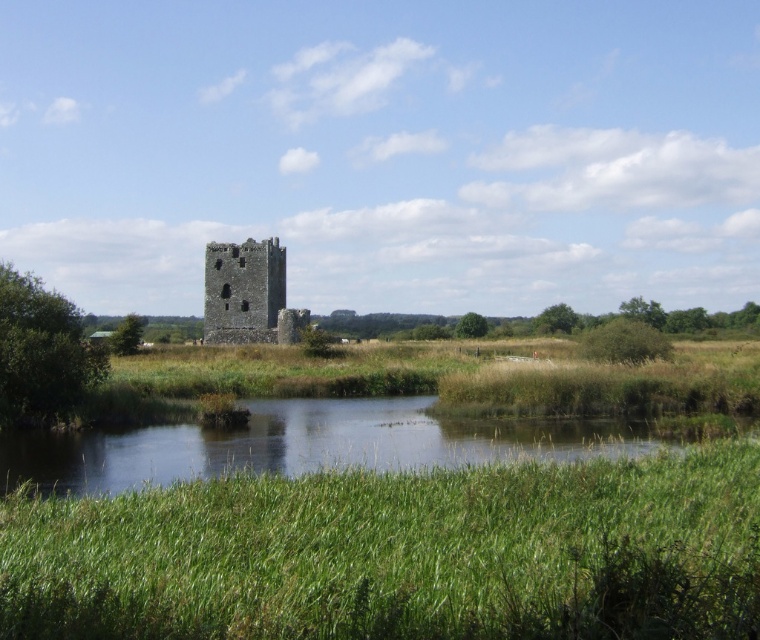
You are standing at the edge of the green grassy river at lower center and want to reach the rustic stone tower at center. Which direction should you head to move towards it?

To reach the rustic stone tower at center from the green grassy river at lower center, you should head to the left since the river is located to the right of the tower.

You are planning to cross the green grassy river at lower center to reach the rustic stone tower at center. Given that the river is wider than the tower, can you estimate the minimum length of the bridge you need to build?

The green grassy river at lower center is wider than the rustic stone tower at center. Therefore, the bridge must be at least as wide as the river to span it, so the minimum length of the bridge should be equal to the width of the river.

You are standing at the edge of the green grassy river at lower center and want to reach the rustic stone tower at center. Which direction should you walk to get closer to the tower?

You should walk towards the center of the image, away from the green grassy river at lower center, since the rustic stone tower at center is located in the middle area and the river is at the lower part.